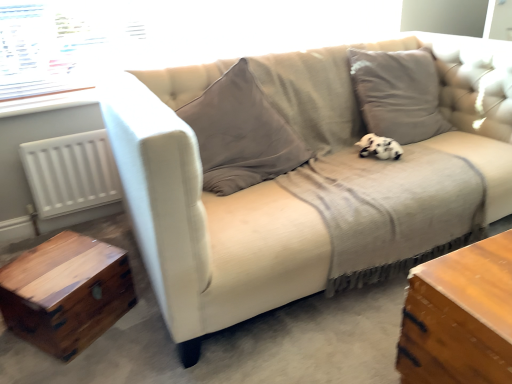
The image size is (512, 384). Find the location of `vacant space underneath white matte radiator at left (from a real-world perspective)`. vacant space underneath white matte radiator at left (from a real-world perspective) is located at coordinates (83, 218).